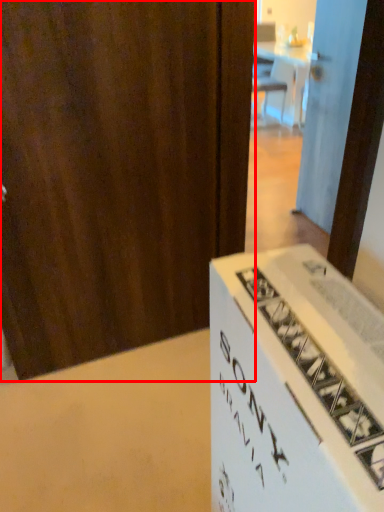
Question: Where is door (annotated by the red box) located in relation to door in the image?

Choices:
 (A) left
 (B) right

Answer: (A)